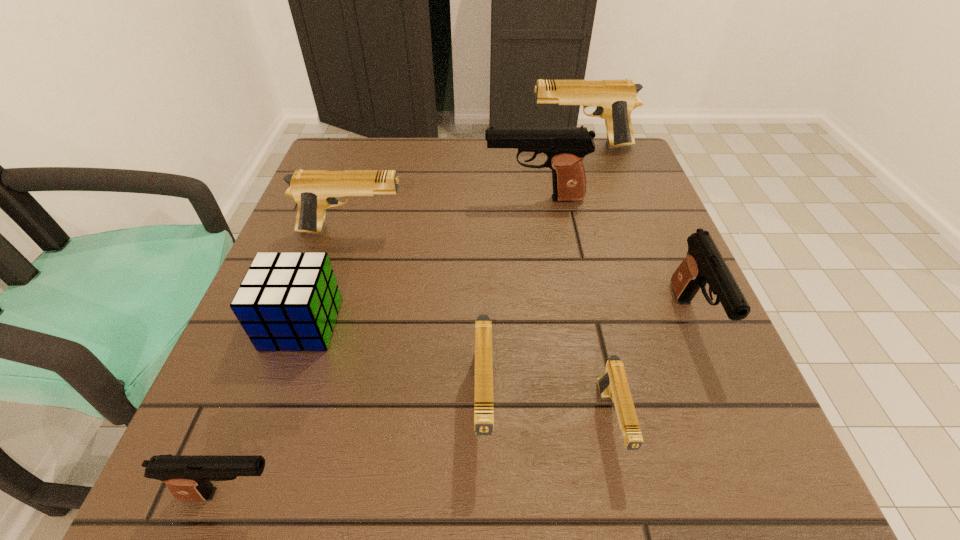
This screenshot has height=540, width=960. Identify the location of free space between the biggest tan pistol and the second farthest black pistol. (636, 232).

Image resolution: width=960 pixels, height=540 pixels. In order to click on vacant space in between the rightmost black pistol and the second farthest pistol in this screenshot , I will do `click(612, 259)`.

Locate an element on the screen. The width and height of the screenshot is (960, 540). free area in between the farthest object and the red cube is located at coordinates tap(442, 235).

In order to click on object identified as the closest to the third smallest tan pistol in this screenshot , I will do `click(289, 301)`.

At what (x,y) coordinates should I click in order to perform the action: click on the third closest object to the second smallest black pistol. Please return your answer as a coordinate pair (x, y). Image resolution: width=960 pixels, height=540 pixels. Looking at the image, I should click on pyautogui.click(x=483, y=380).

Identify which pistol is the nearest to the third nearest tan pistol. Please provide its 2D coordinates. Your answer should be formatted as a tuple, i.e. [(x, y)], where the tuple contains the x and y coordinates of a point satisfying the conditions above.

[(565, 147)]

Locate an element on the screen. pistol that is the third closest to the cube is located at coordinates (483, 380).

Select which black pistol appears as the second closest to the second farthest object. Please provide its 2D coordinates. Your answer should be formatted as a tuple, i.e. [(x, y)], where the tuple contains the x and y coordinates of a point satisfying the conditions above.

[(188, 478)]

Find the location of a particular element. The image size is (960, 540). black pistol that is the third closest to the cube is located at coordinates [x=704, y=263].

You are a GUI agent. You are given a task and a screenshot of the screen. Output one action in this format:
    pyautogui.click(x=<x>, y=<y>)
    Task: Click on the tan pistol that can be found as the fourth closest to the second farthest pistol
    This screenshot has height=540, width=960.
    Given the screenshot: What is the action you would take?
    pyautogui.click(x=613, y=385)